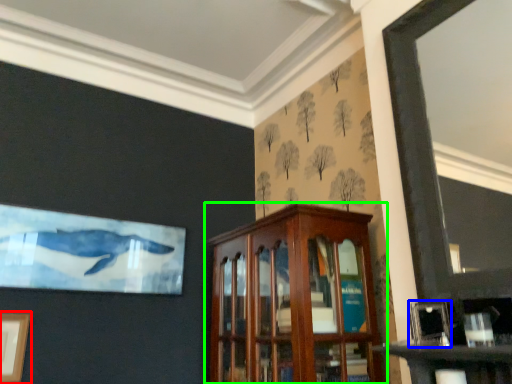
Question: Which object is positioned farthest from picture frame (highlighted by a red box)? Select from picture frame (highlighted by a blue box) and cabinetry (highlighted by a green box).

Choices:
 (A) picture frame
 (B) cabinetry

Answer: (A)